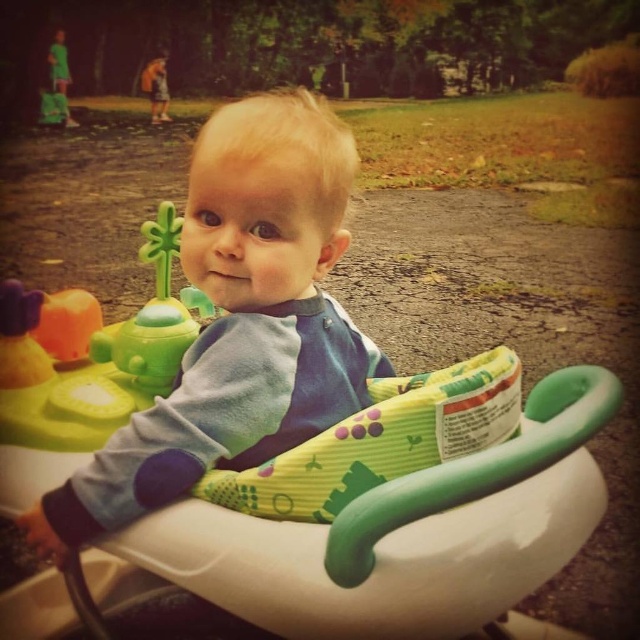
You are a parent watching your child in the baby walker. You see both the green plastic toy at center and the green plastic walker at center. Which object is closer to you?

The green plastic toy at center is closer to you because it is further to the viewer than the green plastic walker at center.

You are a photographer setting up a shot of the blue soft baby at center and the green plastic walker at center. Which object should you focus on first if you want to capture both in the same frame without moving the camera?

The blue soft baby at center is much taller than the green plastic walker at center, so you should focus on the blue soft baby at center first to ensure its height is properly framed before adjusting for the shorter walker.

You are a parent trying to retrieve your child from the baby walker. You see the green plastic toy at center and the green plastic walker at center. Which object is closer to the left side of the image?

The green plastic toy at center is to the left of the green plastic walker at center, so it is closer to the left side of the image.